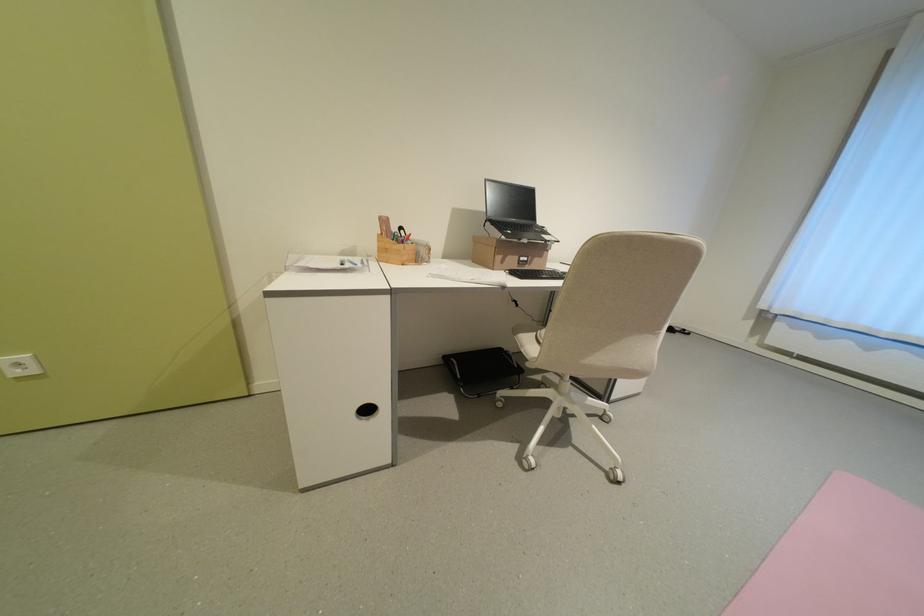
The height and width of the screenshot is (616, 924). What are the coordinates of `chair sitting surface` in the screenshot? It's located at (529, 339).